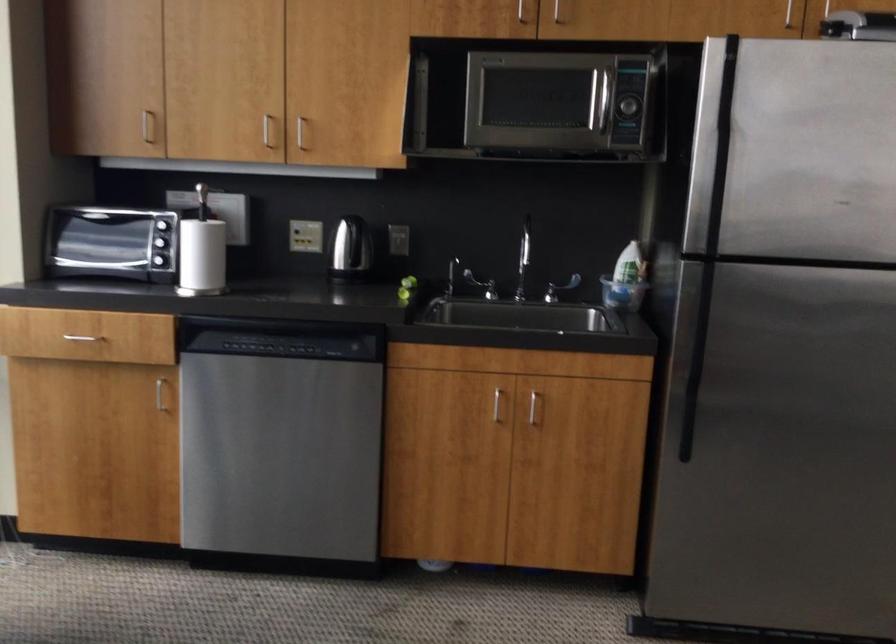
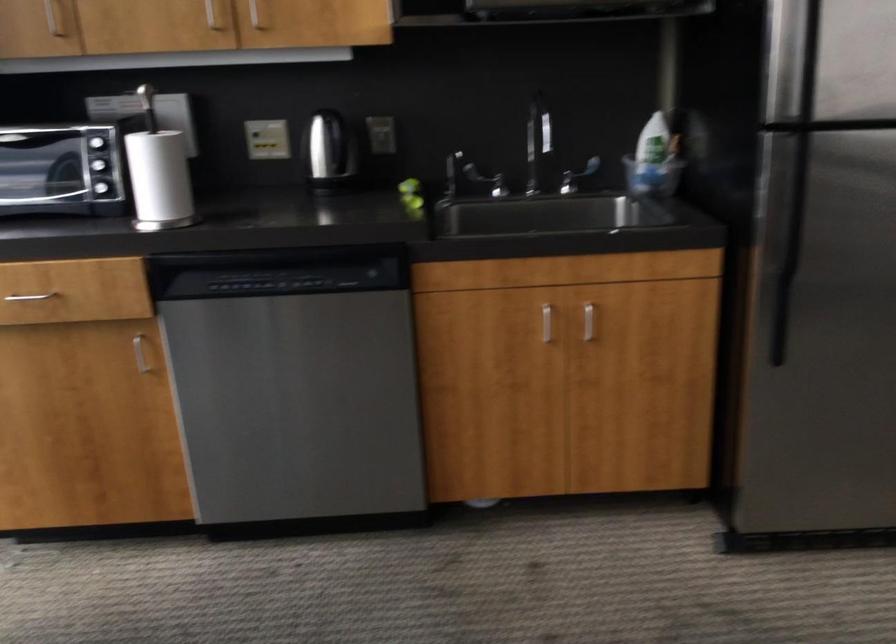
Locate, in the second image, the point that corresponds to (x=624, y=278) in the first image.

(650, 155)